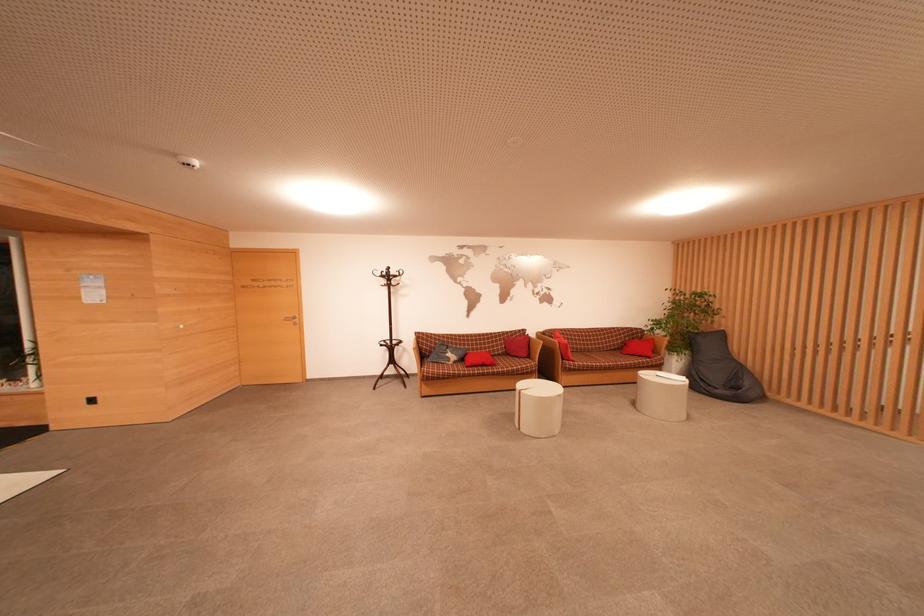
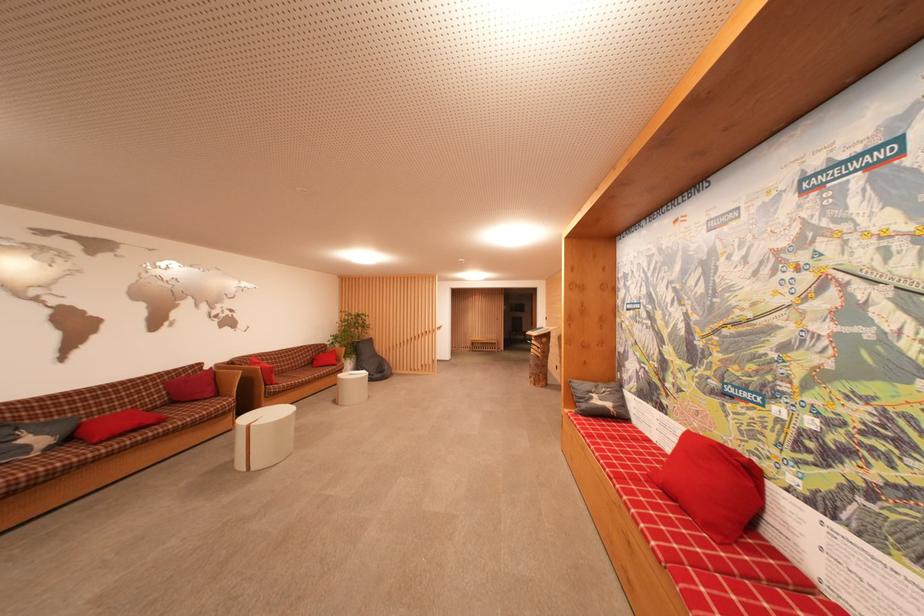
In the second image, find the point that corresponds to the point at 657,342 in the first image.

(338, 354)